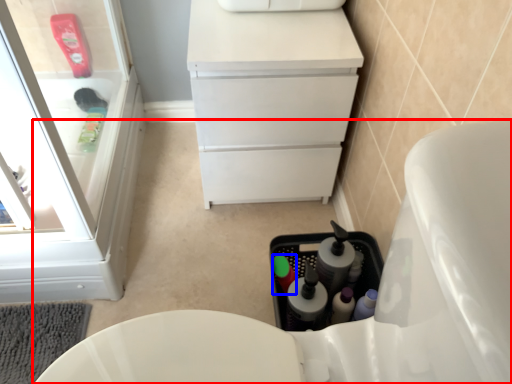
Question: Which point is further to the camera, toilet (highlighted by a red box) or bottle (highlighted by a blue box)?

Choices:
 (A) toilet
 (B) bottle

Answer: (B)